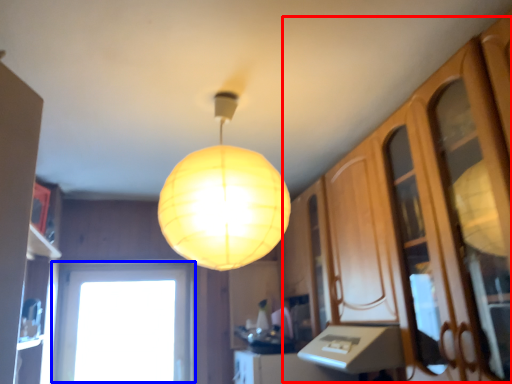
Question: Among these objects, which one is nearest to the camera, dresser (highlighted by a red box) or window (highlighted by a blue box)?

Choices:
 (A) dresser
 (B) window

Answer: (A)